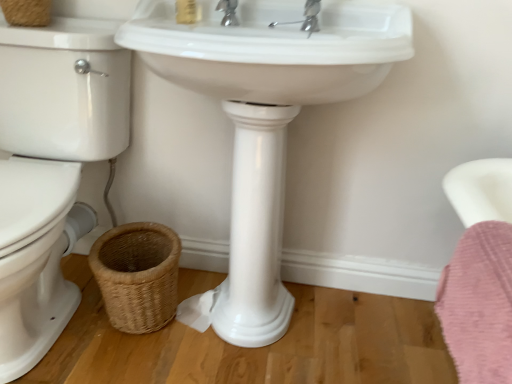
The width and height of the screenshot is (512, 384). Describe the element at coordinates (51, 168) in the screenshot. I see `white glossy toilet bowl at left` at that location.

This screenshot has height=384, width=512. I want to click on white glossy toilet bowl at left, so click(x=51, y=168).

In order to click on woven brown basket at upper left, which ranks as the 1th basket in top-to-bottom order in this screenshot , I will do `click(27, 12)`.

What is the approximate width of white glossy sink at center?

The width of white glossy sink at center is 19.40 inches.

Locate an element on the screen. white glossy sink at center is located at coordinates (264, 120).

This screenshot has width=512, height=384. What do you see at coordinates (228, 12) in the screenshot? I see `chrome metallic faucet at upper center` at bounding box center [228, 12].

Where is `chrome metallic faucet at upper center`? Image resolution: width=512 pixels, height=384 pixels. chrome metallic faucet at upper center is located at coordinates (228, 12).

Describe the element at coordinates (479, 304) in the screenshot. I see `pink fluffy bath towel at lower right` at that location.

Locate an element on the screen. white glossy toilet bowl at left is located at coordinates (51, 168).

Can you tell me how much woven natural basket at lower left, which is the 1th basket from right to left, and polished chrome faucet at upper center differ in facing direction?

2.59 degrees.

From a real-world perspective, is woven natural basket at lower left, the second basket positioned from the top, positioned above or below polished chrome faucet at upper center?

From a real-world perspective, woven natural basket at lower left, the second basket positioned from the top, is physically below polished chrome faucet at upper center.

Does woven natural basket at lower left, the 1th basket from the bottom, have a greater width compared to polished chrome faucet at upper center?

Yes, woven natural basket at lower left, the 1th basket from the bottom, is wider than polished chrome faucet at upper center.

Considering the points (244, 114) and (121, 235), which point is in front, point (244, 114) or point (121, 235)?

The point (244, 114) is closer to the camera.

How different are the orientations of white glossy sink at center and woven natural basket at lower left, which is the 1th basket from right to left, in degrees?

They differ by 3.57 degrees in their facing directions.

Considering the relative sizes of white glossy sink at center and woven natural basket at lower left, the 1th basket from the bottom, in the image provided, is white glossy sink at center thinner than woven natural basket at lower left, the 1th basket from the bottom,?

No, white glossy sink at center is not thinner than woven natural basket at lower left, the 1th basket from the bottom.

Which is closer, (85, 230) or (233, 8)?

Clearly, point (85, 230) is more distant from the camera than point (233, 8).

From the image's perspective, which one is positioned lower, white glossy toilet bowl at left or chrome metallic faucet at upper center?

From the image's view, white glossy toilet bowl at left is below.

How different are the orientations of white glossy toilet bowl at left and chrome metallic faucet at upper center in degrees?

They differ by 1.84 degrees in their facing directions.

Considering the relative positions of white glossy toilet bowl at left and chrome metallic faucet at upper center in the image provided, is white glossy toilet bowl at left in front of chrome metallic faucet at upper center?

Yes, white glossy toilet bowl at left is closer to the viewer.

Is white glossy toilet bowl at left bigger or smaller than matte gold soap at upper center?

Clearly, white glossy toilet bowl at left is larger in size than matte gold soap at upper center.

Would you say white glossy toilet bowl at left is a long distance from matte gold soap at upper center?

Actually, white glossy toilet bowl at left and matte gold soap at upper center are a little close together.

Is point (3, 364) positioned behind point (187, 19)?

That is False.

Is white glossy sink at center completely or partially inside white glossy toilet bowl at left?

No, white glossy sink at center is not a part of white glossy toilet bowl at left.

Does white glossy toilet bowl at left come behind white glossy sink at center?

That is False.

You are a GUI agent. You are given a task and a screenshot of the screen. Output one action in this format:
    pyautogui.click(x=<x>, y=<y>)
    Task: Click on the sink above the white glossy toilet bowl at left (from the image's perspective)
    
    Given the screenshot: What is the action you would take?
    pyautogui.click(x=264, y=120)

Which is closer to the camera, (29, 61) or (273, 250)?

Clearly, point (29, 61) is closer to the camera than point (273, 250).

Is chrome metallic faucet at upper center completely or partially outside of polished chrome faucet at upper center?

Indeed, chrome metallic faucet at upper center is completely outside polished chrome faucet at upper center.

From the image's perspective, which object appears higher, chrome metallic faucet at upper center or polished chrome faucet at upper center?

chrome metallic faucet at upper center appears higher in the image.

Considering the positions of points (238, 24) and (306, 18), is point (238, 24) farther from camera compared to point (306, 18)?

Yes.

Which of these two, chrome metallic faucet at upper center or polished chrome faucet at upper center, is wider?

With larger width is polished chrome faucet at upper center.

Consider the image. Can you see woven brown basket at upper left, arranged as the 2th basket when ordered from the bottom, touching pink fluffy bath towel at lower right?

No.

In the scene shown: Does woven brown basket at upper left, which is the first basket in left-to-right order, have a lesser width compared to pink fluffy bath towel at lower right?

In fact, woven brown basket at upper left, which is the first basket in left-to-right order, might be wider than pink fluffy bath towel at lower right.

Considering the sizes of objects woven brown basket at upper left, positioned as the second basket in right-to-left order, and pink fluffy bath towel at lower right in the image provided, who is taller, woven brown basket at upper left, positioned as the second basket in right-to-left order, or pink fluffy bath towel at lower right?

Standing taller between the two is pink fluffy bath towel at lower right.

Which object is positioned more to the left, woven brown basket at upper left, arranged as the 2th basket when ordered from the bottom, or pink fluffy bath towel at lower right?

From the viewer's perspective, woven brown basket at upper left, arranged as the 2th basket when ordered from the bottom, appears more on the left side.

Locate an element on the screen. Image resolution: width=512 pixels, height=384 pixels. plumbing fixture lying on the right of woven natural basket at lower left, which is the 1th basket from right to left is located at coordinates [311, 16].

Starting from the white glossy sink at center, which basket is the 1st one to the left? Please provide its 2D coordinates.

[(137, 275)]

Considering their positions, is woven brown basket at upper left, positioned as the second basket in right-to-left order, positioned closer to matte gold soap at upper center than polished chrome faucet at upper center?

Based on the image, polished chrome faucet at upper center appears to be nearer to matte gold soap at upper center.

Looking at this image, when comparing their distances from pink fluffy bath towel at lower right, does woven natural basket at lower left, which is the 2th basket in left-to-right order, or white glossy toilet bowl at left seem further?

white glossy toilet bowl at left is further to pink fluffy bath towel at lower right.

Which object lies nearer to the anchor point polished chrome faucet at upper center, white glossy sink at center or woven natural basket at lower left, the 1th basket from the bottom?

white glossy sink at center is closer to polished chrome faucet at upper center.

When comparing their distances from white glossy toilet bowl at left, does white glossy sink at center or matte gold soap at upper center seem further?

Based on the image, matte gold soap at upper center appears to be further to white glossy toilet bowl at left.

Looking at the image, which one is located closer to pink fluffy bath towel at lower right, woven brown basket at upper left, which is the first basket in left-to-right order, or polished chrome faucet at upper center?

polished chrome faucet at upper center is positioned closer to the anchor pink fluffy bath towel at lower right.

When comparing their distances from matte gold soap at upper center, does pink fluffy bath towel at lower right or white glossy toilet bowl at left seem further?

pink fluffy bath towel at lower right.

When comparing their distances from white glossy sink at center, does woven brown basket at upper left, which ranks as the 1th basket in top-to-bottom order, or pink fluffy bath towel at lower right seem closer?

Based on the image, pink fluffy bath towel at lower right appears to be nearer to white glossy sink at center.

Which object lies nearer to the anchor point pink fluffy bath towel at lower right, matte gold soap at upper center or white glossy toilet bowl at left?

Among the two, matte gold soap at upper center is located nearer to pink fluffy bath towel at lower right.

This screenshot has width=512, height=384. What are the coordinates of `tap that lies between matte gold soap at upper center and woven natural basket at lower left, the 1th basket from the bottom, from top to bottom` in the screenshot? It's located at (228, 12).

What are the coordinates of `plumbing fixture between chrome metallic faucet at upper center and white glossy sink at center in the vertical direction` in the screenshot? It's located at (311, 16).

Identify the location of toilet bowl that lies between woven brown basket at upper left, which is the first basket in left-to-right order, and woven natural basket at lower left, the 1th basket from the bottom, from top to bottom. The image size is (512, 384). (51, 168).

Find the location of a particular element. This screenshot has width=512, height=384. tap between matte gold soap at upper center and polished chrome faucet at upper center is located at coordinates (228, 12).